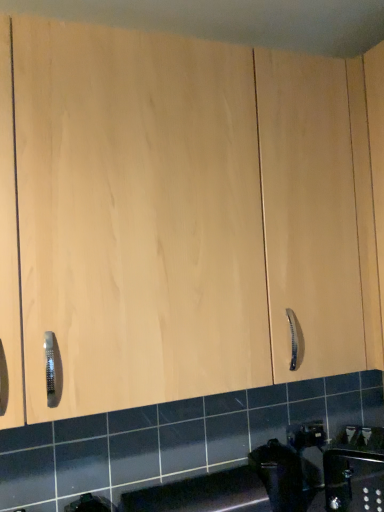
Measure the distance between point (278,454) and camera.

4.31 feet.

You are a GUI agent. You are given a task and a screenshot of the screen. Output one action in this format:
    pyautogui.click(x=<x>, y=<y>)
    Task: Click on the black plastic trash can at lower center
    The image size is (384, 512).
    Given the screenshot: What is the action you would take?
    pyautogui.click(x=281, y=476)

Describe the element at coordinates (281, 476) in the screenshot. The width and height of the screenshot is (384, 512). I see `black plastic trash can at lower center` at that location.

What is the approximate height of satin nickel faucet at lower right?

satin nickel faucet at lower right is 8.67 inches tall.

The height and width of the screenshot is (512, 384). Identify the location of satin nickel faucet at lower right. (355, 469).

The image size is (384, 512). Describe the element at coordinates (355, 469) in the screenshot. I see `satin nickel faucet at lower right` at that location.

Locate an element on the screen. The height and width of the screenshot is (512, 384). black plastic trash can at lower center is located at coordinates (281, 476).

Considering the relative positions of satin nickel faucet at lower right and black plastic trash can at lower center in the image provided, is satin nickel faucet at lower right to the left of black plastic trash can at lower center from the viewer's perspective?

In fact, satin nickel faucet at lower right is to the right of black plastic trash can at lower center.

Looking at this image, relative to black plastic trash can at lower center, is satin nickel faucet at lower right in front or behind?

satin nickel faucet at lower right is positioned closer to the viewer than black plastic trash can at lower center.

Is point (343, 454) more distant than point (276, 498)?

Yes, it is.

From the image's perspective, is satin nickel faucet at lower right located above or below black plastic trash can at lower center?

satin nickel faucet at lower right is situated higher than black plastic trash can at lower center in the image.

From a real-world perspective, is satin nickel faucet at lower right positioned above or below black plastic trash can at lower center?

Clearly, from a real-world perspective, satin nickel faucet at lower right is below black plastic trash can at lower center.

Between satin nickel faucet at lower right and black plastic trash can at lower center, which one has larger width?

satin nickel faucet at lower right is wider.

From the picture: Is satin nickel faucet at lower right taller or shorter than black plastic trash can at lower center?

satin nickel faucet at lower right is shorter than black plastic trash can at lower center.

Based on their sizes in the image, would you say satin nickel faucet at lower right is bigger or smaller than black plastic trash can at lower center?

satin nickel faucet at lower right is bigger than black plastic trash can at lower center.

Looking at this image, do you think satin nickel faucet at lower right is within black plastic trash can at lower center, or outside of it?

satin nickel faucet at lower right is not inside black plastic trash can at lower center, it's outside.

Can you see satin nickel faucet at lower right touching black plastic trash can at lower center?

No, satin nickel faucet at lower right is not with black plastic trash can at lower center.

Is satin nickel faucet at lower right facing towards black plastic trash can at lower center?

No.

What's the angular difference between satin nickel faucet at lower right and black plastic trash can at lower center's facing directions?

46.9 degrees separate the facing orientations of satin nickel faucet at lower right and black plastic trash can at lower center.

Measure the distance from satin nickel faucet at lower right to black plastic trash can at lower center.

satin nickel faucet at lower right is 7.26 inches from black plastic trash can at lower center.

Find the location of a particular element. Image resolution: width=384 pixels, height=512 pixels. sink beneath the black plastic trash can at lower center (from a real-world perspective) is located at coordinates (355, 469).

Consider the image. Considering the positions of objects black plastic trash can at lower center and satin nickel faucet at lower right in the image provided, who is more to the right, black plastic trash can at lower center or satin nickel faucet at lower right?

Positioned to the right is satin nickel faucet at lower right.

Which object is further away from the camera, black plastic trash can at lower center or satin nickel faucet at lower right?

black plastic trash can at lower center is further from the camera.

Which is farther from the camera, [270,473] or [362,473]?

Positioned behind is point [362,473].

From the image's perspective, is black plastic trash can at lower center below satin nickel faucet at lower right?

Yes, from the image's perspective, black plastic trash can at lower center is below satin nickel faucet at lower right.

From a real-world perspective, relative to satin nickel faucet at lower right, is black plastic trash can at lower center vertically above or below?

black plastic trash can at lower center is situated higher than satin nickel faucet at lower right in the real world.

Considering the sizes of objects black plastic trash can at lower center and satin nickel faucet at lower right in the image provided, who is thinner, black plastic trash can at lower center or satin nickel faucet at lower right?

Thinner between the two is black plastic trash can at lower center.

From their relative heights in the image, would you say black plastic trash can at lower center is taller or shorter than satin nickel faucet at lower right?

Considering their sizes, black plastic trash can at lower center has more height than satin nickel faucet at lower right.

Considering the relative sizes of black plastic trash can at lower center and satin nickel faucet at lower right in the image provided, is black plastic trash can at lower center bigger than satin nickel faucet at lower right?

No.

Is black plastic trash can at lower center positioned beyond the bounds of satin nickel faucet at lower right?

Yes, black plastic trash can at lower center is not within satin nickel faucet at lower right.

Looking at this image, is black plastic trash can at lower center touching satin nickel faucet at lower right?

There is a gap between black plastic trash can at lower center and satin nickel faucet at lower right.

Does black plastic trash can at lower center turn towards satin nickel faucet at lower right?

No, black plastic trash can at lower center is not turned towards satin nickel faucet at lower right.

How different are the orientations of black plastic trash can at lower center and satin nickel faucet at lower right in degrees?

They differ by 46.9 degrees in their facing directions.

This screenshot has width=384, height=512. Identify the location of sink above the black plastic trash can at lower center (from the image's perspective). (355, 469).

The width and height of the screenshot is (384, 512). Identify the location of appliance above the satin nickel faucet at lower right (from a real-world perspective). (281, 476).

Where is `appliance on the left of the satin nickel faucet at lower right`? The width and height of the screenshot is (384, 512). appliance on the left of the satin nickel faucet at lower right is located at coordinates tap(281, 476).